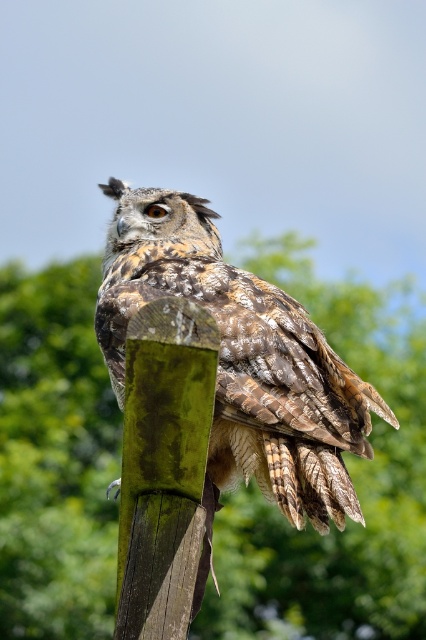
Consider the image. Does green mossy post at center appear over camouflage feathered owl at center?

Correct, green mossy post at center is located above camouflage feathered owl at center.

Does point (233, 525) lie in front of point (285, 314)?

No, it is not.

Who is more forward, (46, 312) or (275, 397)?

Point (275, 397) is in front.

Find the location of a particular element. The width and height of the screenshot is (426, 640). green mossy post at center is located at coordinates (351, 477).